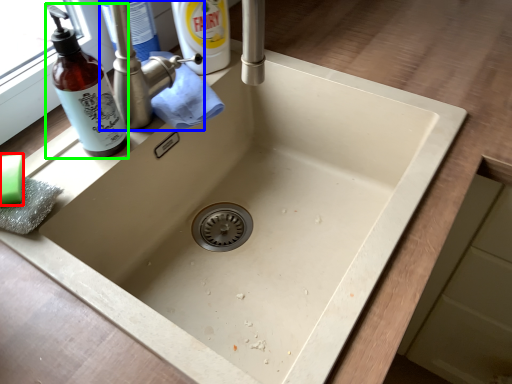
Question: Estimate the real-world distances between objects in this image. Which object is closer to soap (highlighted by a red box), tap (highlighted by a blue box) or bottle (highlighted by a green box)?

Choices:
 (A) tap
 (B) bottle

Answer: (B)